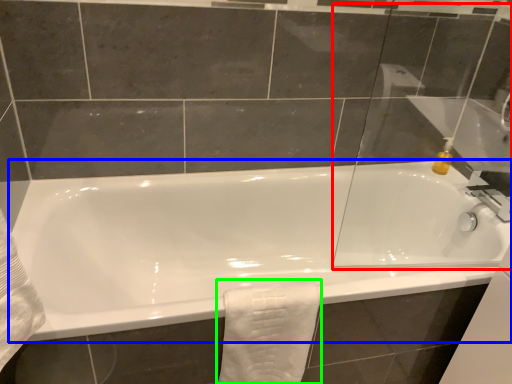
Question: Which is nearer to the glass door (highlighted by a red box)? bathtub (highlighted by a blue box) or bath towel (highlighted by a green box).

Choices:
 (A) bathtub
 (B) bath towel

Answer: (A)